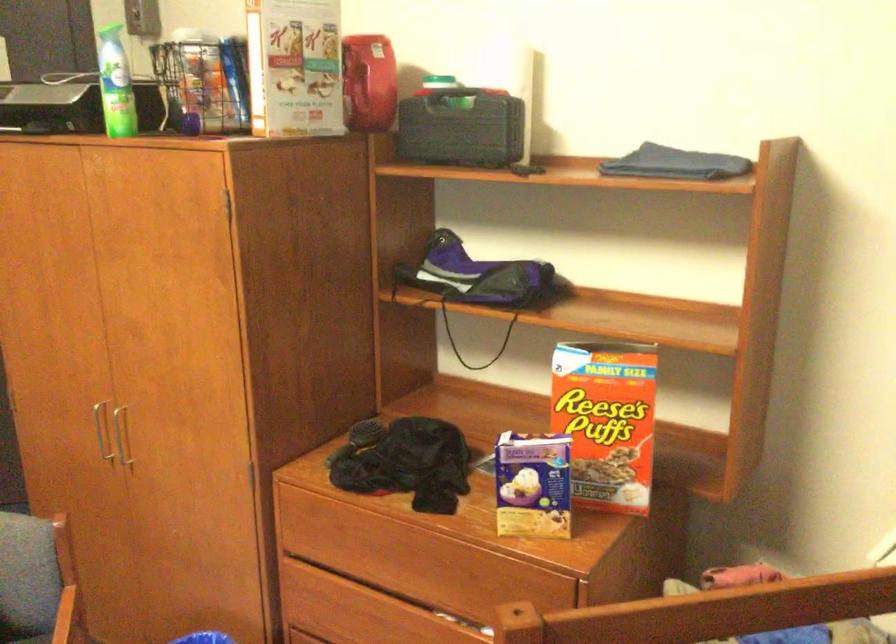
Where would you lift the Reese's Puffs box? Please return your answer as a coordinate pair (x, y).

(606, 420)